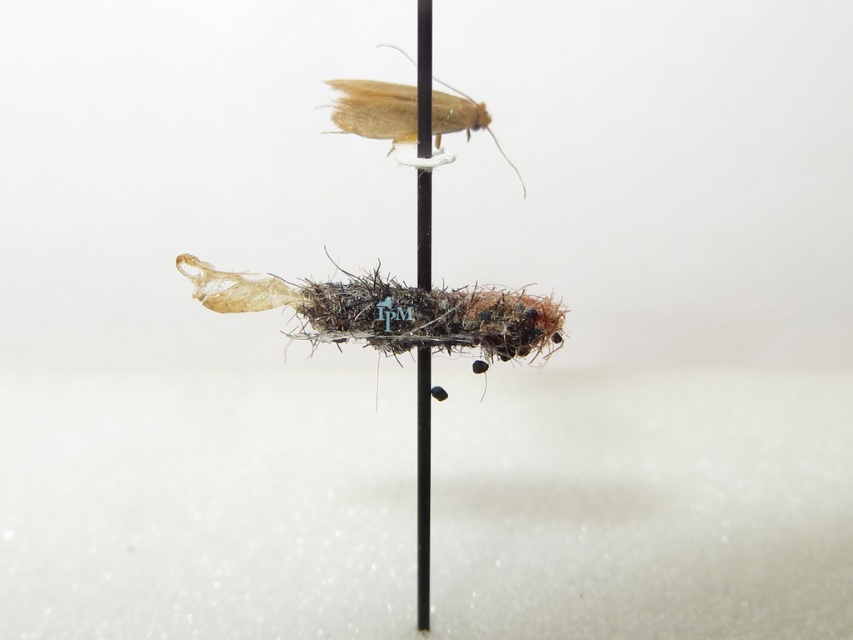
In the scene shown: Is fuzzy brown caterpillar at center in front of translucent beige moth at upper center?

No, it is behind translucent beige moth at upper center.

How much distance is there between fuzzy brown caterpillar at center and translucent beige moth at upper center?

fuzzy brown caterpillar at center and translucent beige moth at upper center are 6.07 inches apart from each other.

Which is behind, point (344, 323) or point (450, 160)?

Point (344, 323)

The height and width of the screenshot is (640, 853). What are the coordinates of `fuzzy brown caterpillar at center` in the screenshot? It's located at (392, 312).